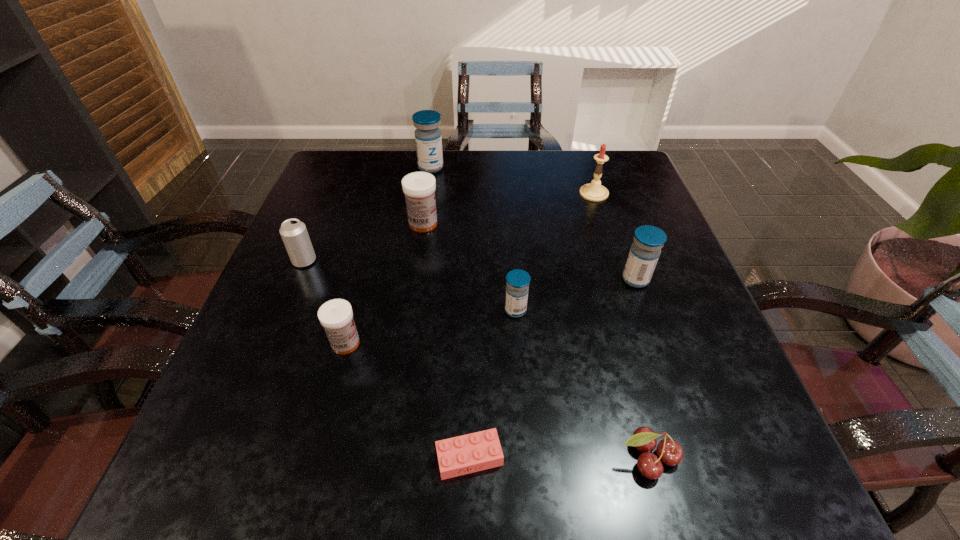
Locate an element on the screen. Image resolution: width=960 pixels, height=540 pixels. the leftmost blue medicine is located at coordinates (428, 139).

Locate an element on the screen. The width and height of the screenshot is (960, 540). the farthest object is located at coordinates (428, 139).

You are a GUI agent. You are given a task and a screenshot of the screen. Output one action in this format:
    pyautogui.click(x=<x>, y=<y>)
    Task: Click on the eighth nearest object
    The height and width of the screenshot is (540, 960).
    Given the screenshot: What is the action you would take?
    pyautogui.click(x=594, y=191)

This screenshot has height=540, width=960. In order to click on candle in this screenshot , I will do `click(594, 191)`.

Locate an element on the screen. The width and height of the screenshot is (960, 540). the right white medicine is located at coordinates (419, 188).

Where is `the seventh nearest object`? The height and width of the screenshot is (540, 960). the seventh nearest object is located at coordinates (419, 188).

Image resolution: width=960 pixels, height=540 pixels. Find the location of `the fifth nearest object`. the fifth nearest object is located at coordinates (644, 253).

Locate an element on the screen. The width and height of the screenshot is (960, 540). the second smallest blue medicine is located at coordinates (644, 253).

Locate an element on the screen. This screenshot has height=540, width=960. beer can is located at coordinates (294, 234).

Identify the location of the sixth nearest object. (294, 234).